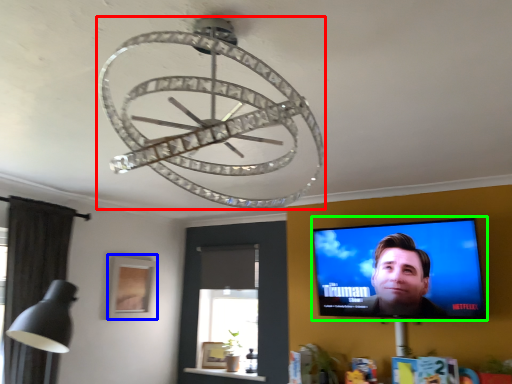
Question: Which object is the closest to the lamp (highlighted by a red box)? Choose among these: picture frame (highlighted by a blue box) or computer screen (highlighted by a green box).

Choices:
 (A) picture frame
 (B) computer screen

Answer: (B)